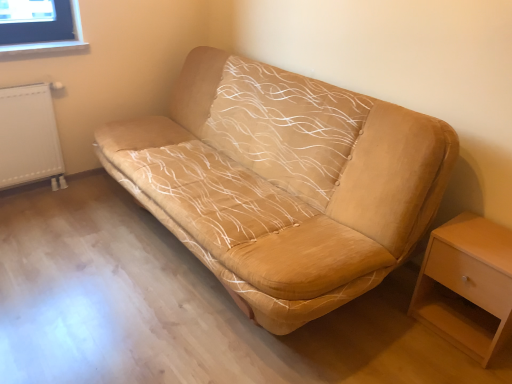
At what (x,y) coordinates should I click in order to perform the action: click on empty space that is in between beige suede sofa at center and white textured radiator at left. Please return your answer as a coordinate pair (x, y). The height and width of the screenshot is (384, 512). Looking at the image, I should click on (108, 242).